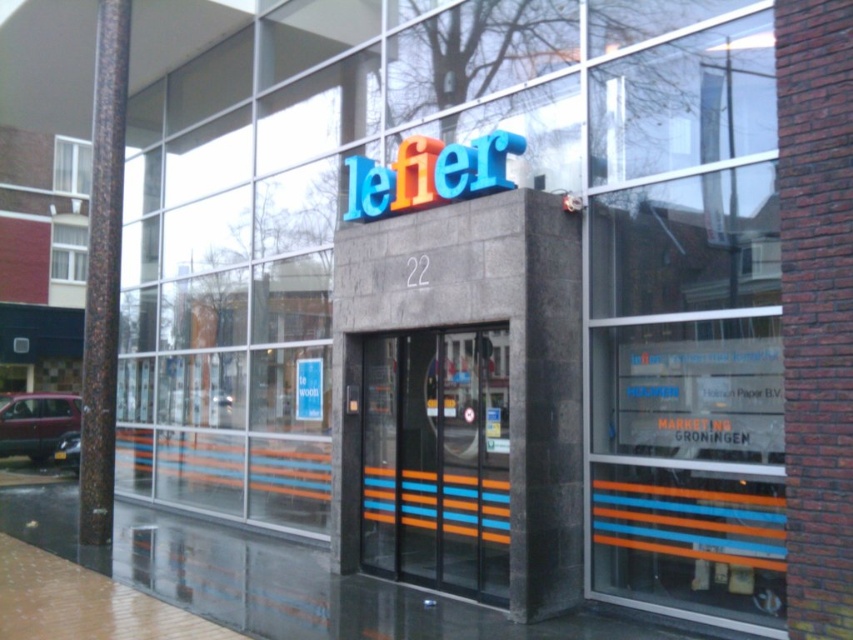
Question: Which of these objects is positioned farthest from the white fabric curtain at upper left?

Choices:
 (A) white plastic window at upper left
 (B) multicolored plastic sign at center
 (C) transparent glass window at center

Answer: (C)

Question: Is transparent glass window at center wider than white fabric curtain at upper left?

Choices:
 (A) no
 (B) yes

Answer: (B)

Question: Is transparent glass window at center wider than white fabric curtain at upper left?

Choices:
 (A) no
 (B) yes

Answer: (B)

Question: Which point appears closest to the camera in this image?

Choices:
 (A) (479, 419)
 (B) (73, 150)

Answer: (A)

Question: Can you confirm if transparent glass window at center is bigger than orange striped glass door at center?

Choices:
 (A) no
 (B) yes

Answer: (B)

Question: Which of the following is the farthest from the observer?

Choices:
 (A) transparent glass window at center
 (B) orange striped glass door at center
 (C) multicolored plastic sign at center
 (D) white fabric curtain at upper left

Answer: (D)